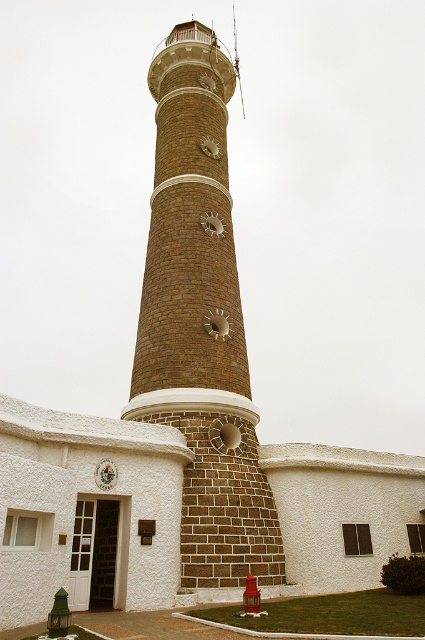
Question: Is brown brick tower at center below red matte hydrant at lower center?

Choices:
 (A) yes
 (B) no

Answer: (B)

Question: Does brown brick tower at center come in front of red matte hydrant at lower center?

Choices:
 (A) yes
 (B) no

Answer: (B)

Question: Is brown brick tower at center further to camera compared to red matte hydrant at lower center?

Choices:
 (A) no
 (B) yes

Answer: (B)

Question: Which of the following is the closest to the observer?

Choices:
 (A) brown brick tower at center
 (B) red matte hydrant at lower center

Answer: (B)

Question: Among these objects, which one is nearest to the camera?

Choices:
 (A) brown brick tower at center
 (B) red matte hydrant at lower center

Answer: (B)